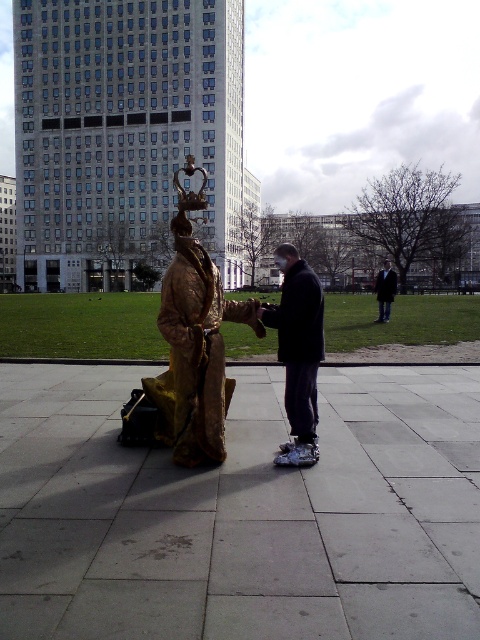
Consider the image. You are a photographer trying to capture a photo of the bronze statue at center and the dark brown leather jacket at center. Since you want both subjects to be clearly visible in the frame, which one should you focus on first to ensure proper depth of field?

The bronze statue at center is taller than the dark brown leather jacket at center, so you should focus on the bronze statue at center first to ensure proper depth of field.

You are an architect designing a new plaza and need to place a 2.5 meter tall sculpture. You have two options from the image, the bronze statue at center and the metallic gold statue at center. Which one is taller and suitable for your design?

The bronze statue at center is taller than the metallic gold statue at center, so it is suitable for the 2.5 meter requirement if it meets the height.